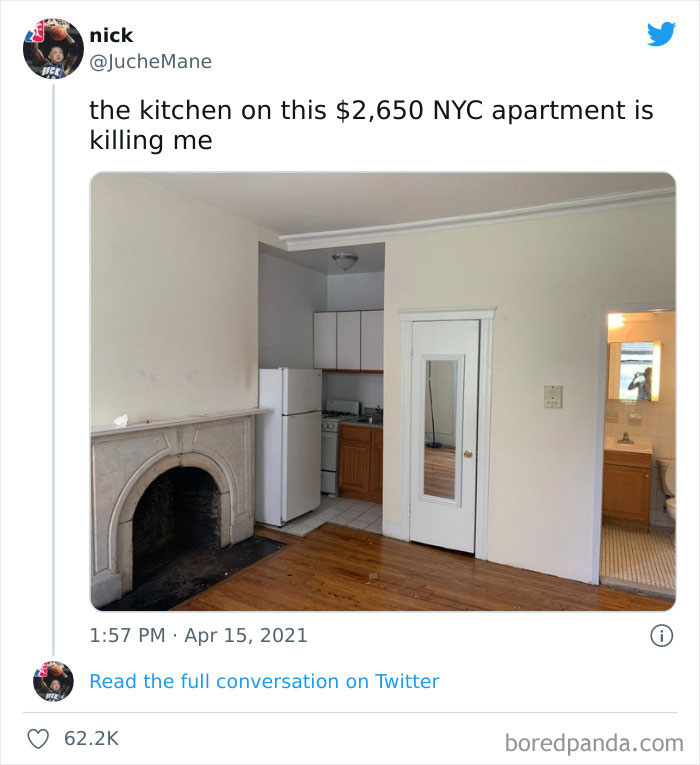
The height and width of the screenshot is (765, 700). What are the coordinates of `door` in the screenshot? It's located at (472, 334).